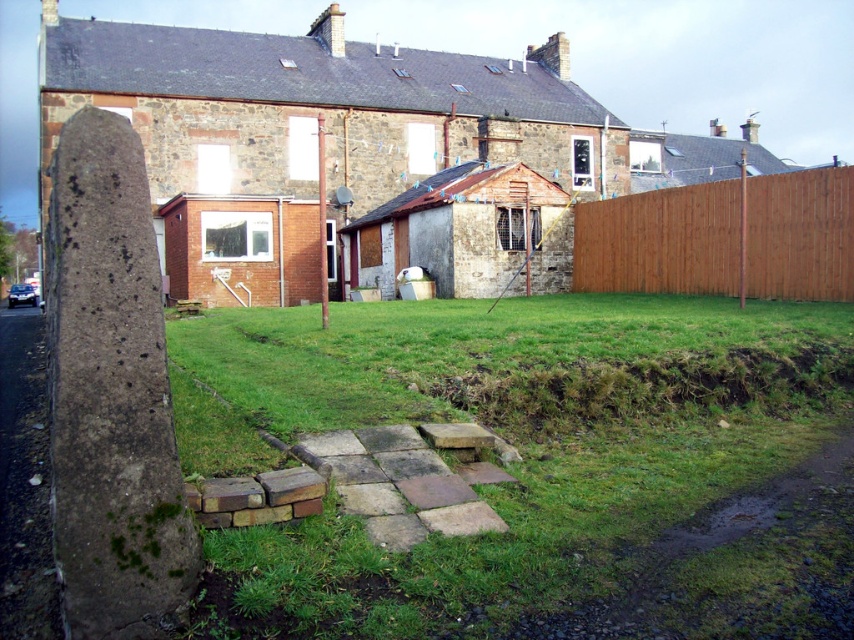
You are a delivery person trying to navigate a narrow path between the brown rough stone pillar at left and the brown wooden fence at right. The path is only 1.5 meters wide. Can you pass through without touching either the pillar or the fence?

The distance between the brown rough stone pillar at left and the brown wooden fence at right is 16.32 meters, which is much wider than the 1.5 meter path width. Therefore, the delivery person can easily pass through the path without touching either the pillar or the fence.